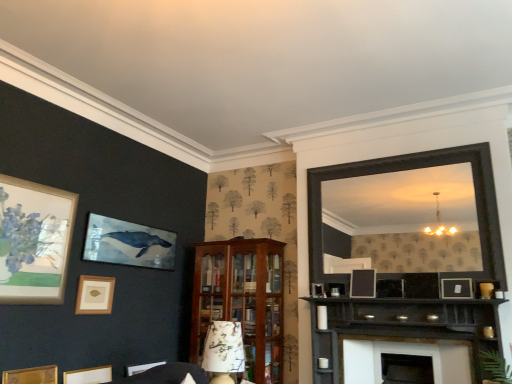
Question: Is floral-patterned fabric lampshade at center bigger or smaller than matte gold picture frame at lower left, acting as the 4th picture frame starting from the right?

Choices:
 (A) small
 (B) big

Answer: (B)

Question: From the image's perspective, is floral-patterned fabric lampshade at center located above or below matte gold picture frame at lower left, the 2th picture frame in the left-to-right sequence?

Choices:
 (A) above
 (B) below

Answer: (B)

Question: Estimate the real-world distances between objects in this image. Which object is farther from the wooden cabinet at center?

Choices:
 (A) floral-patterned fabric lampshade at center
 (B) matte gold picture frame at lower left, positioned as the 3th picture frame in left-to-right order
 (C) matte black picture frame at center, which is counted as the 4th picture frame, starting from the left
 (D) black wooden mirror at upper right
 (E) matte black picture frame at upper right, acting as the first picture frame starting from the right

Answer: (E)

Question: Which is nearer to the wooden picture frame at lower left, the fifth picture frame when ordered from right to left?

Choices:
 (A) dark wood shelf at lower right
 (B) matte black picture frame at upper right, acting as the first picture frame starting from the right
 (C) wooden cabinet at center
 (D) matte gold picture frame at lower left, acting as the 4th picture frame starting from the right
 (E) matte black picture frame at center, which is counted as the 4th picture frame, starting from the left

Answer: (D)